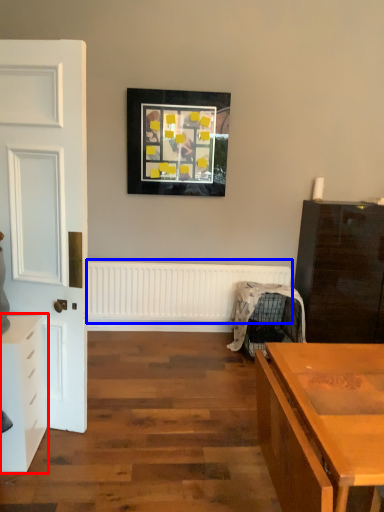
Question: Which object appears farthest to the camera in this image, chest of drawers (highlighted by a red box) or radiator (highlighted by a blue box)?

Choices:
 (A) chest of drawers
 (B) radiator

Answer: (B)